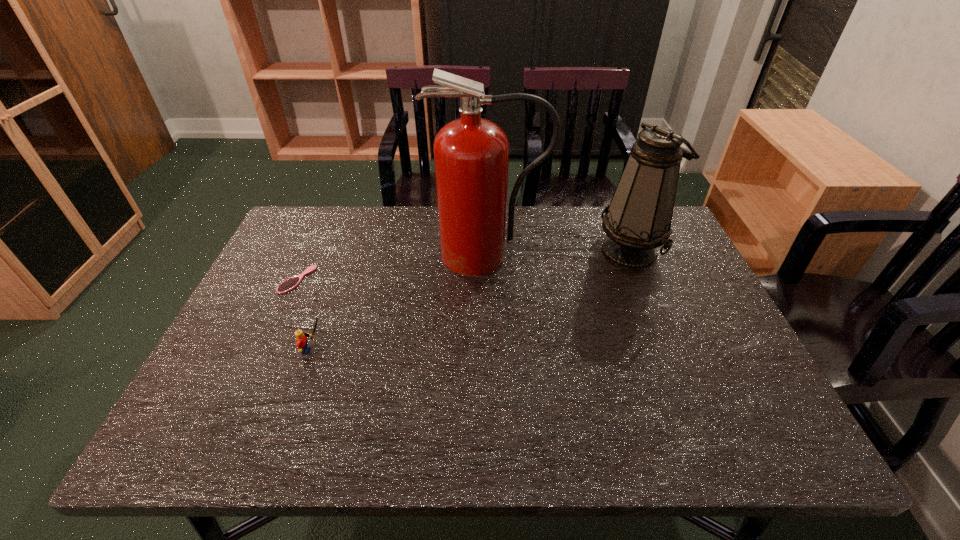
Locate an element on the screen. Image resolution: width=960 pixels, height=540 pixels. vacant space at the far left corner of the desktop is located at coordinates (311, 250).

Where is `vacant area that lies between the second shortest object and the leftmost object`? The height and width of the screenshot is (540, 960). vacant area that lies between the second shortest object and the leftmost object is located at coordinates (305, 315).

This screenshot has height=540, width=960. I want to click on free space that is in between the fire extinguisher and the rightmost object, so click(559, 252).

This screenshot has width=960, height=540. In order to click on empty space between the third tallest object and the third shortest object in this screenshot , I will do `click(472, 300)`.

You are a GUI agent. You are given a task and a screenshot of the screen. Output one action in this format:
    pyautogui.click(x=<x>, y=<y>)
    Task: Click on the free space between the leftmost object and the tallest object
    The height and width of the screenshot is (540, 960).
    Given the screenshot: What is the action you would take?
    pyautogui.click(x=393, y=267)

Where is `vacant area between the third tallest object and the third object from left to right`? vacant area between the third tallest object and the third object from left to right is located at coordinates (400, 302).

What are the coordinates of `vacant space that is in between the shortest object and the tallest object` in the screenshot? It's located at (393, 267).

In order to click on empty space between the second object from left to right and the leftmost object in this screenshot , I will do `click(305, 315)`.

Find the location of a particular element. The image size is (960, 540). object that is the closest to the second shortest object is located at coordinates (289, 284).

Select which object is the second closest to the shortest object. Please provide its 2D coordinates. Your answer should be formatted as a tuple, i.e. [(x, y)], where the tuple contains the x and y coordinates of a point satisfying the conditions above.

[(471, 155)]